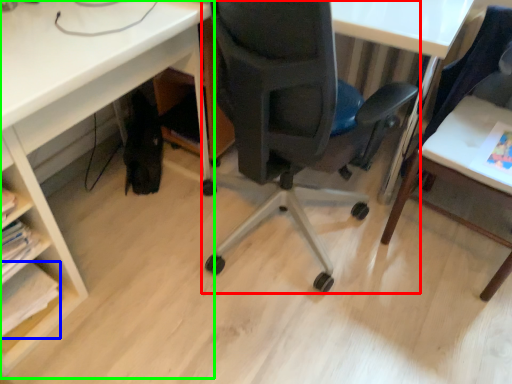
Question: Considering the real-world distances, which object is farthest from chair (highlighted by a red box)? book (highlighted by a blue box) or desk (highlighted by a green box)?

Choices:
 (A) book
 (B) desk

Answer: (A)